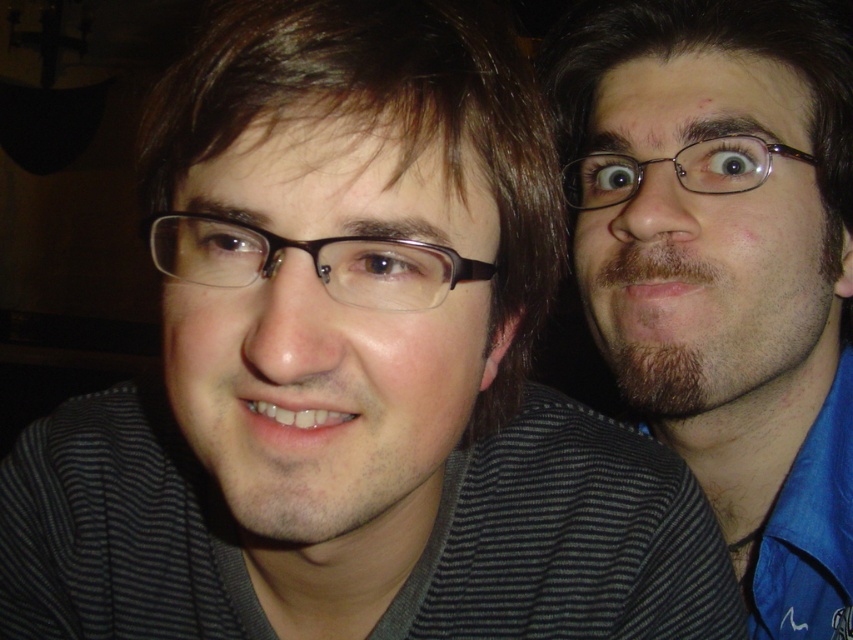
Who is positioned more to the left, brown hair at upper right or matte brown glasses at center?

matte brown glasses at center

Is brown hair at upper right closer to the viewer compared to matte brown glasses at center?

No, it is behind matte brown glasses at center.

Is point (815, 392) less distant than point (444, 292)?

No, (815, 392) is behind (444, 292).

This screenshot has height=640, width=853. In order to click on brown hair at upper right in this screenshot , I will do `click(724, 266)`.

Measure the distance between point (401, 252) and camera.

Point (401, 252) and camera are 12.86 inches apart.

Who is lower down, matte brown glasses at center or black plastic glasses at upper right?

matte brown glasses at center

What do you see at coordinates (312, 260) in the screenshot? Image resolution: width=853 pixels, height=640 pixels. I see `matte brown glasses at center` at bounding box center [312, 260].

Where is `matte brown glasses at center`? matte brown glasses at center is located at coordinates (312, 260).

Is brown hair at upper right closer to camera compared to black plastic glasses at upper right?

Yes, brown hair at upper right is in front of black plastic glasses at upper right.

This screenshot has height=640, width=853. I want to click on brown hair at upper right, so click(x=724, y=266).